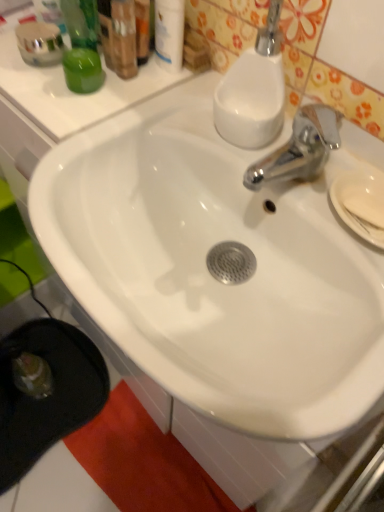
Question: Is red cotton beach towel at lower left in front of or behind green matte jar at upper left in the image?

Choices:
 (A) front
 (B) behind

Answer: (B)

Question: From their relative heights in the image, would you say red cotton beach towel at lower left is taller or shorter than green matte jar at upper left?

Choices:
 (A) tall
 (B) short

Answer: (B)

Question: Based on their relative distances, which object is nearer to the white glossy sink at center?

Choices:
 (A) white glossy lotion at upper center
 (B) white glossy soap dispenser at upper right
 (C) red cotton beach towel at lower left
 (D) white matte soap at right
 (E) green matte jar at upper left

Answer: (B)

Question: Which is farther from the red cotton beach towel at lower left?

Choices:
 (A) green matte jar at upper left
 (B) white matte soap at right
 (C) white glossy soap dispenser at upper right
 (D) white glossy sink at center
 (E) white glossy lotion at upper center

Answer: (E)